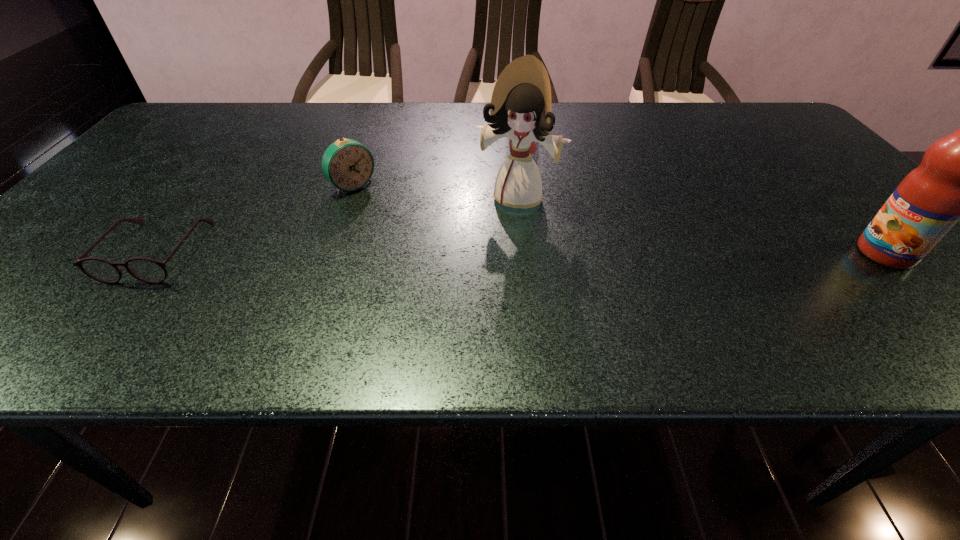
The height and width of the screenshot is (540, 960). In order to click on free spot on the desktop that is between the spectacles and the rightmost object and is positioned on the front-facing side of the second shortest object in this screenshot , I will do `click(427, 252)`.

You are a GUI agent. You are given a task and a screenshot of the screen. Output one action in this format:
    pyautogui.click(x=<x>, y=<y>)
    Task: Click on the vacant space on the desktop that is between the leftmost object and the fruit juice and is positioned at the front face of the second object from right to left
    Image resolution: width=960 pixels, height=540 pixels.
    Given the screenshot: What is the action you would take?
    pyautogui.click(x=492, y=252)